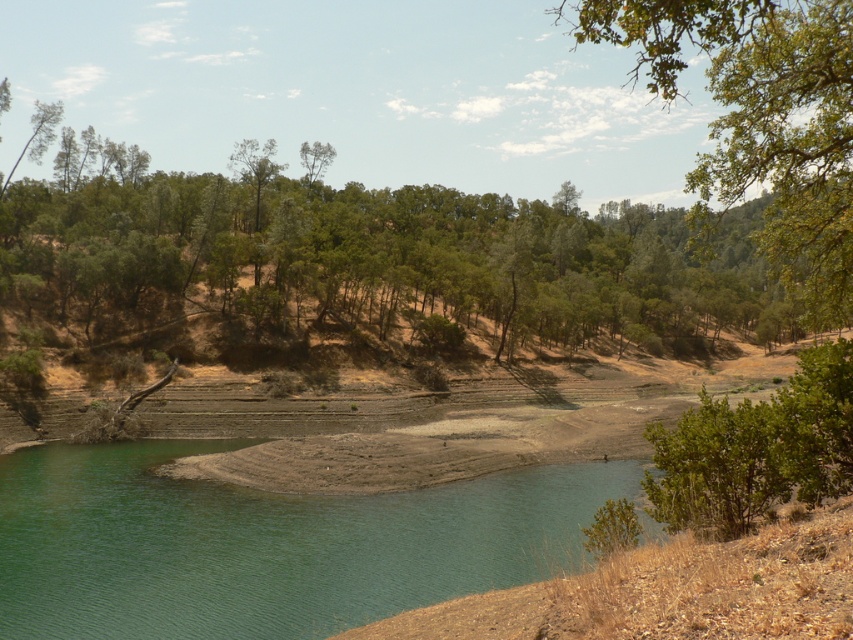
Question: Which point is farther to the camera?

Choices:
 (A) green leafy tree at upper right
 (B) green smooth water at lower left

Answer: (B)

Question: Can you confirm if green leafy tree at upper center is wider than green leafy tree at upper right?

Choices:
 (A) yes
 (B) no

Answer: (A)

Question: Which point is farther to the camera?

Choices:
 (A) green leafy tree at upper right
 (B) green smooth water at lower left
 (C) green leafy tree at upper center

Answer: (C)

Question: Can you confirm if green leafy tree at upper center is bigger than green smooth water at lower left?

Choices:
 (A) yes
 (B) no

Answer: (A)

Question: Is green leafy tree at upper center behind green smooth water at lower left?

Choices:
 (A) no
 (B) yes

Answer: (B)

Question: Which point appears farthest from the camera in this image?

Choices:
 (A) (701, 160)
 (B) (346, 497)
 (C) (213, 262)

Answer: (A)